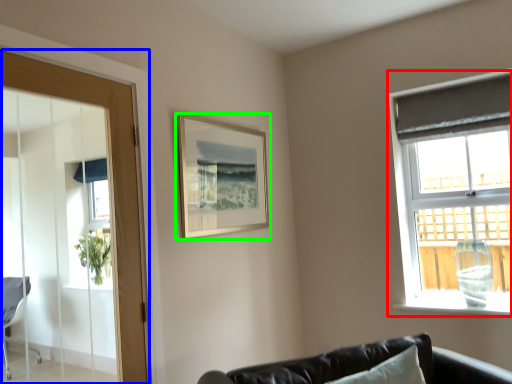
Question: Which object is the closest to the window (highlighted by a red box)? Choose among these: door (highlighted by a blue box) or picture frame (highlighted by a green box).

Choices:
 (A) door
 (B) picture frame

Answer: (B)